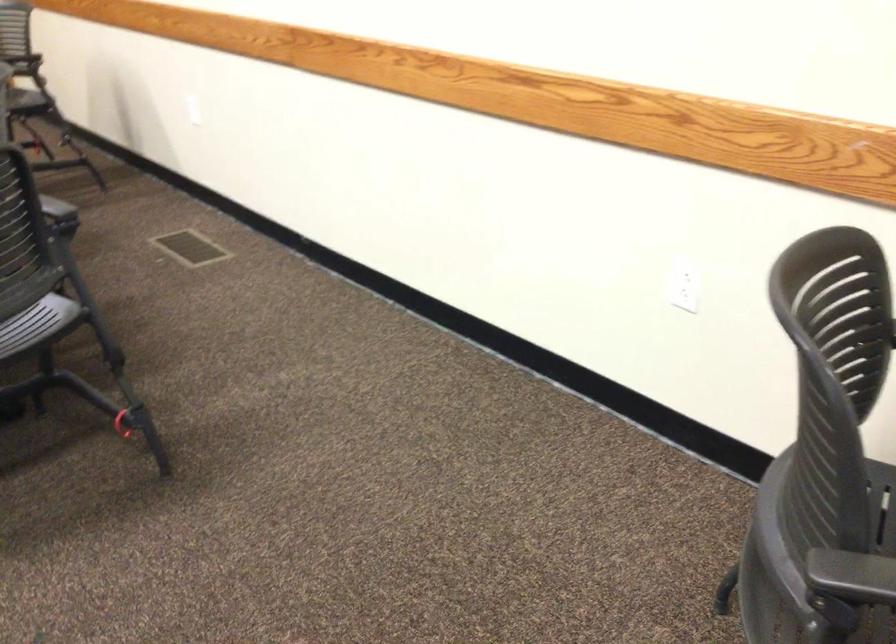
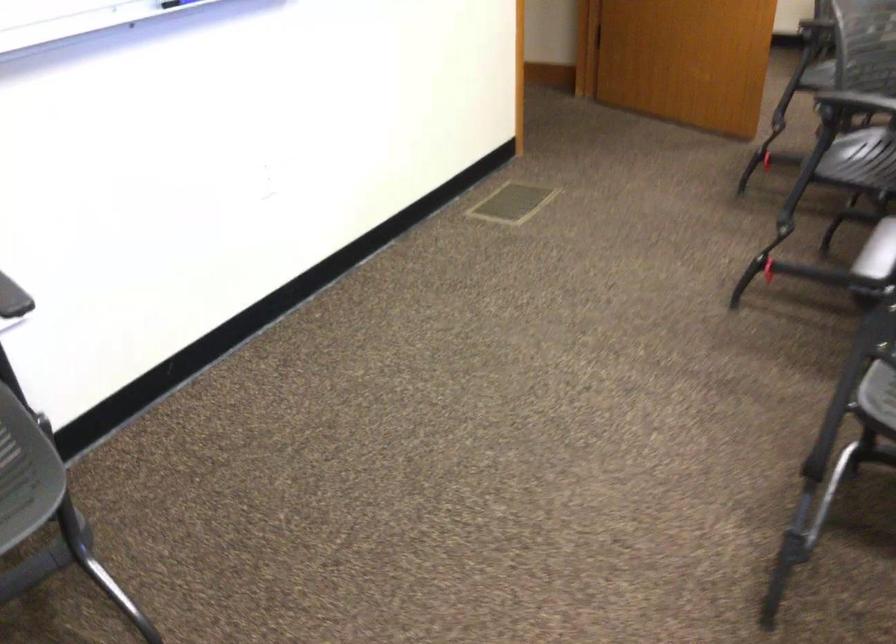
How did the camera likely rotate?

The camera's rotation is toward left-down.